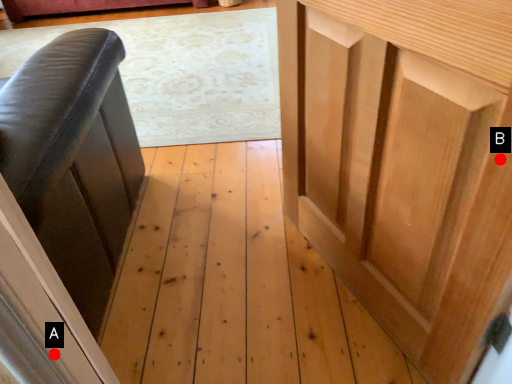
Question: Two points are circled on the image, labeled by A and B beside each circle. Which point is closer to the camera?

Choices:
 (A) A is closer
 (B) B is closer

Answer: (B)